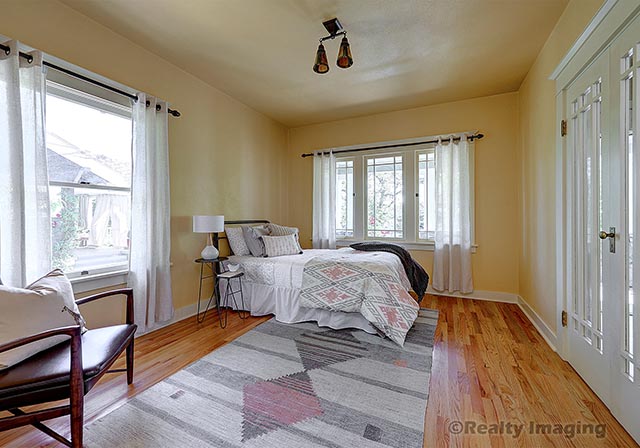
Where is `windows`? The image size is (640, 448). windows is located at coordinates (426, 215), (378, 214), (349, 216), (102, 230).